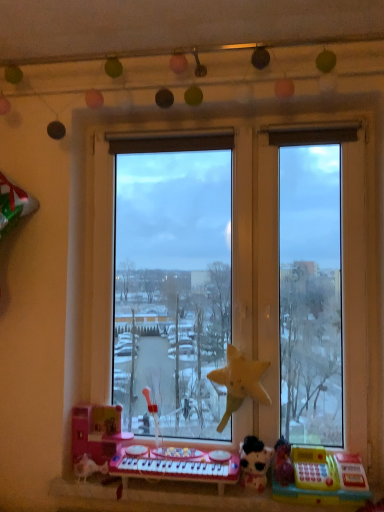
Question: From a real-world perspective, does plastic toy keyboard at lower center stand above pink plastic toy at lower left, placed as the 1th toy when sorted from left to right?

Choices:
 (A) yes
 (B) no

Answer: (B)

Question: Is plastic toy keyboard at lower center in contact with pink plastic toy at lower left, placed as the 1th toy when sorted from left to right?

Choices:
 (A) yes
 (B) no

Answer: (B)

Question: Is plastic toy keyboard at lower center aimed at pink plastic toy at lower left, placed as the 1th toy when sorted from left to right?

Choices:
 (A) yes
 (B) no

Answer: (B)

Question: Is plastic toy keyboard at lower center completely or partially outside of pink plastic toy at lower left, the fourth toy when ordered from right to left?

Choices:
 (A) yes
 (B) no

Answer: (A)

Question: Does plastic toy keyboard at lower center have a lesser height compared to pink plastic toy at lower left, placed as the 1th toy when sorted from left to right?

Choices:
 (A) yes
 (B) no

Answer: (A)

Question: From a real-world perspective, is pink plastic musical keyboard at lower center above or below plastic toy keyboard at lower center?

Choices:
 (A) above
 (B) below

Answer: (A)

Question: Considering their positions, is pink plastic musical keyboard at lower center located in front of or behind plastic toy keyboard at lower center?

Choices:
 (A) behind
 (B) front

Answer: (A)

Question: From the image's perspective, is pink plastic musical keyboard at lower center positioned above or below plastic toy keyboard at lower center?

Choices:
 (A) above
 (B) below

Answer: (A)

Question: In the image, is pink plastic musical keyboard at lower center on the left side or the right side of plastic toy keyboard at lower center?

Choices:
 (A) right
 (B) left

Answer: (B)

Question: Considering the positions of yellow matte star at center, the 3th toy positioned from the right, and yellow plastic cash register at lower right, placed as the first toy when sorted from right to left, in the image, is yellow matte star at center, the 3th toy positioned from the right, taller or shorter than yellow plastic cash register at lower right, placed as the first toy when sorted from right to left,?

Choices:
 (A) short
 (B) tall

Answer: (B)

Question: From the image's perspective, is yellow matte star at center, the 3th toy positioned from the right, located above or below yellow plastic cash register at lower right, positioned as the fourth toy in left-to-right order?

Choices:
 (A) below
 (B) above

Answer: (B)

Question: In terms of size, does yellow matte star at center, the 3th toy positioned from the right, appear bigger or smaller than yellow plastic cash register at lower right, placed as the first toy when sorted from right to left?

Choices:
 (A) big
 (B) small

Answer: (B)

Question: Is yellow matte star at center, the 2th toy when ordered from left to right, inside or outside of yellow plastic cash register at lower right, placed as the first toy when sorted from right to left?

Choices:
 (A) inside
 (B) outside

Answer: (B)

Question: From the image's perspective, is plastic toy keyboard at lower center above or below yellow matte star at center, the 3th toy positioned from the right?

Choices:
 (A) below
 (B) above

Answer: (A)

Question: In terms of width, does plastic toy keyboard at lower center look wider or thinner when compared to yellow matte star at center, the 3th toy positioned from the right?

Choices:
 (A) thin
 (B) wide

Answer: (B)